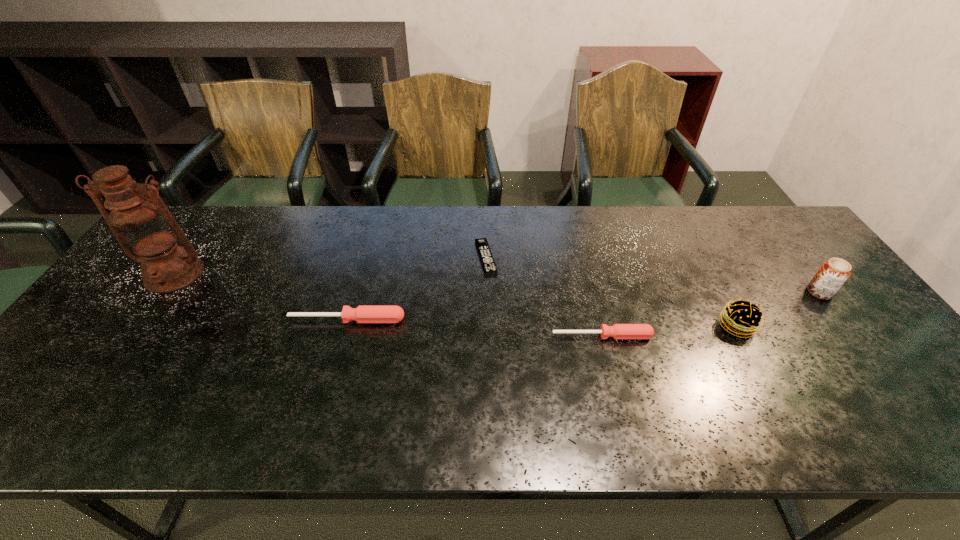
At what (x,y) coordinates should I click in order to perform the action: click on object that is at the right edge. Please return your answer as a coordinate pair (x, y). The height and width of the screenshot is (540, 960). Looking at the image, I should click on (833, 273).

In the image, there is a desktop. Where is `vacant space at the far edge`? This screenshot has height=540, width=960. vacant space at the far edge is located at coordinates (600, 234).

At what (x,y) coordinates should I click in order to perform the action: click on vacant space at the near edge. Please return your answer as a coordinate pair (x, y). Image resolution: width=960 pixels, height=540 pixels. Looking at the image, I should click on [258, 372].

The image size is (960, 540). I want to click on vacant space at the left edge of the desktop, so click(x=126, y=287).

This screenshot has height=540, width=960. I want to click on vacant region at the far left corner of the desktop, so click(230, 210).

Find the location of `vacant area at the far right corner`. vacant area at the far right corner is located at coordinates (781, 231).

The width and height of the screenshot is (960, 540). In order to click on vacant space that is in between the remote control and the fifth object from left to right in this screenshot , I will do `click(612, 292)`.

Where is `free space between the right screwdriver and the beer can`? free space between the right screwdriver and the beer can is located at coordinates (710, 314).

The image size is (960, 540). Identify the location of vacant space in between the rightmost object and the remote control. (653, 275).

You are a GUI agent. You are given a task and a screenshot of the screen. Output one action in this format:
    pyautogui.click(x=<x>, y=<y>)
    Task: Click on the free space between the shortest object and the third tallest object
    This screenshot has width=960, height=540.
    Given the screenshot: What is the action you would take?
    pyautogui.click(x=612, y=292)